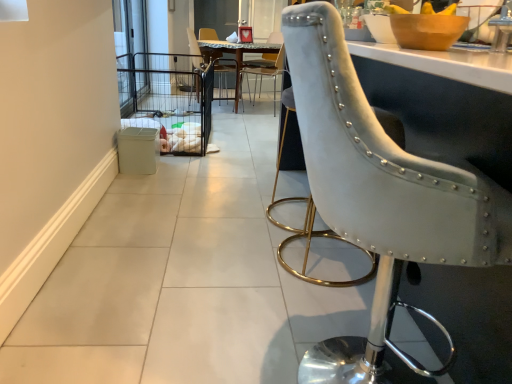
Question: From the image's perspective, does wooden bowl at upper right appear lower than clear glass screen door at upper left?

Choices:
 (A) no
 (B) yes

Answer: (B)

Question: Is wooden bowl at upper right facing towards clear glass screen door at upper left?

Choices:
 (A) yes
 (B) no

Answer: (B)

Question: From the image's perspective, is wooden bowl at upper right over clear glass screen door at upper left?

Choices:
 (A) yes
 (B) no

Answer: (B)

Question: Considering the relative sizes of wooden bowl at upper right and clear glass screen door at upper left in the image provided, is wooden bowl at upper right wider than clear glass screen door at upper left?

Choices:
 (A) yes
 (B) no

Answer: (A)

Question: Is wooden bowl at upper right touching clear glass screen door at upper left?

Choices:
 (A) no
 (B) yes

Answer: (A)

Question: Is the position of wooden bowl at upper right less distant than that of clear glass screen door at upper left?

Choices:
 (A) no
 (B) yes

Answer: (B)

Question: Is marble top table at center aimed at metallic black chair at center, which appears as the 1th chair when viewed from the back?

Choices:
 (A) yes
 (B) no

Answer: (B)

Question: Is marble top table at center positioned behind metallic black chair at center, which appears as the 1th chair when viewed from the back?

Choices:
 (A) no
 (B) yes

Answer: (B)

Question: Does marble top table at center contain metallic black chair at center, the 3th chair in the front-to-back sequence?

Choices:
 (A) no
 (B) yes

Answer: (B)

Question: From the image's perspective, would you say marble top table at center is shown under metallic black chair at center, the 3th chair in the front-to-back sequence?

Choices:
 (A) yes
 (B) no

Answer: (B)

Question: Is marble top table at center positioned before metallic black chair at center, which appears as the 1th chair when viewed from the back?

Choices:
 (A) yes
 (B) no

Answer: (B)

Question: Considering the relative sizes of marble top table at center and metallic black chair at center, which appears as the 1th chair when viewed from the back, in the image provided, is marble top table at center wider than metallic black chair at center, which appears as the 1th chair when viewed from the back,?

Choices:
 (A) no
 (B) yes

Answer: (B)

Question: From the image's perspective, is suede-like gray chair at right, which is counted as the 1th chair, starting from the front, over marble top table at center?

Choices:
 (A) no
 (B) yes

Answer: (A)